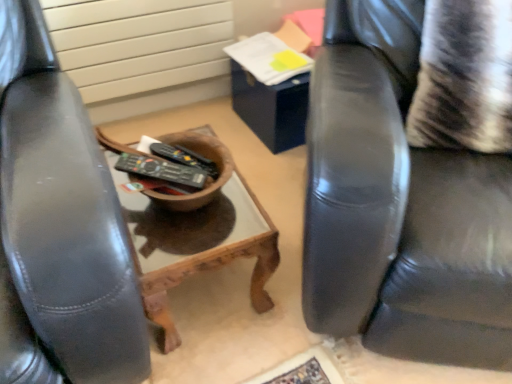
Question: Is striped fabric pillow at right further to camera compared to black leather chair at right?

Choices:
 (A) no
 (B) yes

Answer: (B)

Question: Considering the relative positions of striped fabric pillow at right and black leather chair at right in the image provided, is striped fabric pillow at right to the left of black leather chair at right from the viewer's perspective?

Choices:
 (A) yes
 (B) no

Answer: (A)

Question: Is striped fabric pillow at right at the right side of black leather chair at right?

Choices:
 (A) yes
 (B) no

Answer: (B)

Question: Is the surface of striped fabric pillow at right in direct contact with black leather chair at right?

Choices:
 (A) yes
 (B) no

Answer: (B)

Question: Considering the relative sizes of striped fabric pillow at right and black leather chair at right in the image provided, is striped fabric pillow at right taller than black leather chair at right?

Choices:
 (A) no
 (B) yes

Answer: (A)

Question: Does striped fabric pillow at right have a greater width compared to black leather chair at right?

Choices:
 (A) no
 (B) yes

Answer: (A)

Question: Is white textured radiator at upper left placed right next to black plastic remote control at center, the 1th remote control in the back-to-front sequence?

Choices:
 (A) yes
 (B) no

Answer: (B)

Question: Does white textured radiator at upper left appear on the right side of black plastic remote control at center, the second remote control in the front-to-back sequence?

Choices:
 (A) no
 (B) yes

Answer: (A)

Question: Can you confirm if white textured radiator at upper left is wider than black plastic remote control at center, the 1th remote control in the back-to-front sequence?

Choices:
 (A) no
 (B) yes

Answer: (A)

Question: Can you confirm if white textured radiator at upper left is positioned to the left of black plastic remote control at center, the second remote control in the front-to-back sequence?

Choices:
 (A) no
 (B) yes

Answer: (B)

Question: Is white textured radiator at upper left oriented away from black plastic remote control at center, the second remote control in the front-to-back sequence?

Choices:
 (A) yes
 (B) no

Answer: (B)

Question: Can black plastic remote control at center, the 1th remote control in the back-to-front sequence, be found inside white textured radiator at upper left?

Choices:
 (A) yes
 (B) no

Answer: (B)

Question: Considering the relative sizes of black plastic remote control at center, which ranks as the 2th remote control in back-to-front order, and white textured radiator at upper left in the image provided, is black plastic remote control at center, which ranks as the 2th remote control in back-to-front order, smaller than white textured radiator at upper left?

Choices:
 (A) no
 (B) yes

Answer: (B)